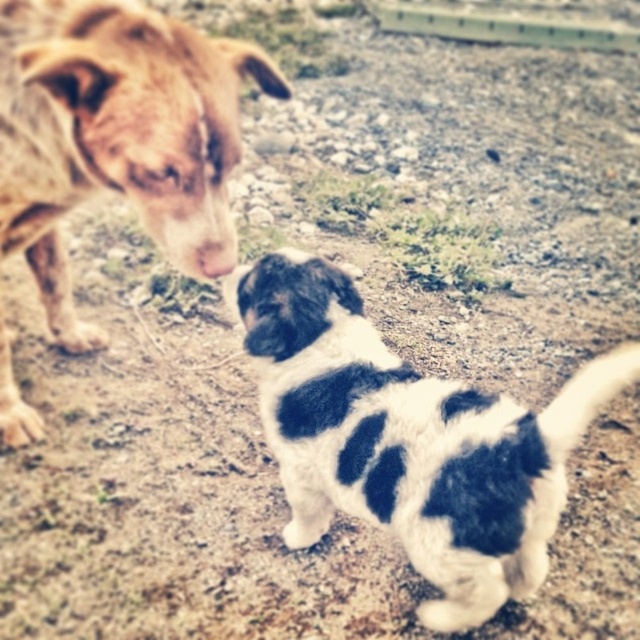
Does black and white fur at center have a larger size compared to brown speckled fur at left?

No.

Is black and white fur at center taller than brown speckled fur at left?

Correct, black and white fur at center is much taller as brown speckled fur at left.

Is point (365, 378) closer to viewer compared to point (12, 131)?

Yes, point (365, 378) is in front of point (12, 131).

The image size is (640, 640). What are the coordinates of `black and white fur at center` in the screenshot? It's located at (410, 440).